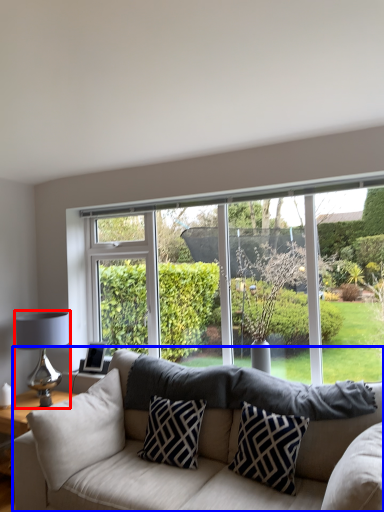
Question: Which of the following is the farthest to the observer, table lamp (highlighted by a red box) or studio couch (highlighted by a blue box)?

Choices:
 (A) table lamp
 (B) studio couch

Answer: (A)